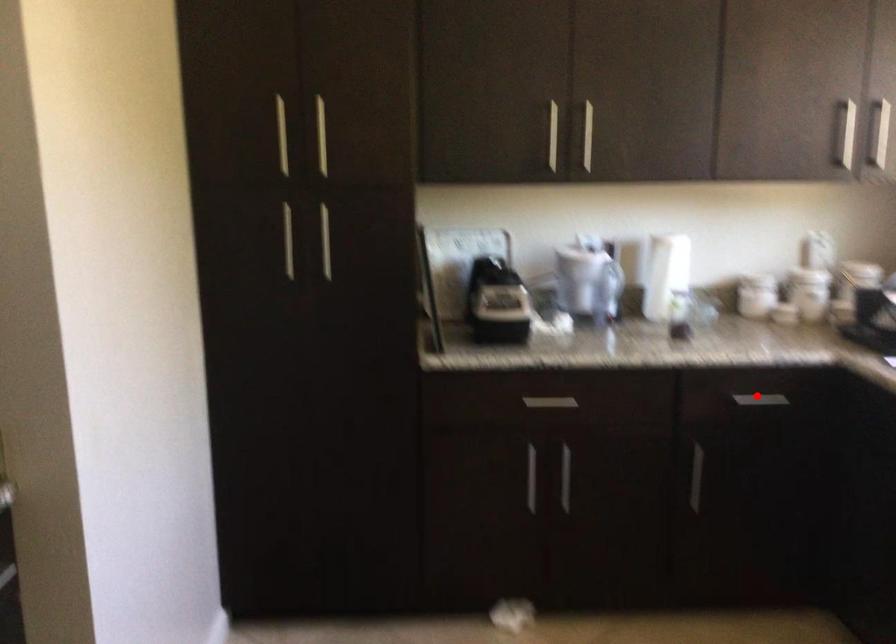
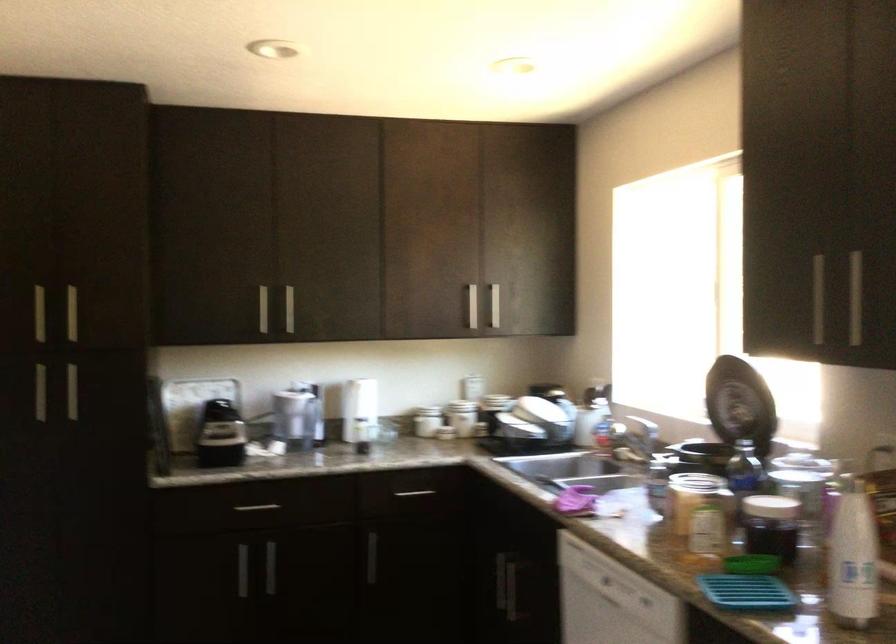
Locate, in the second image, the point that corresponds to the highlighted location in the first image.

(414, 493)